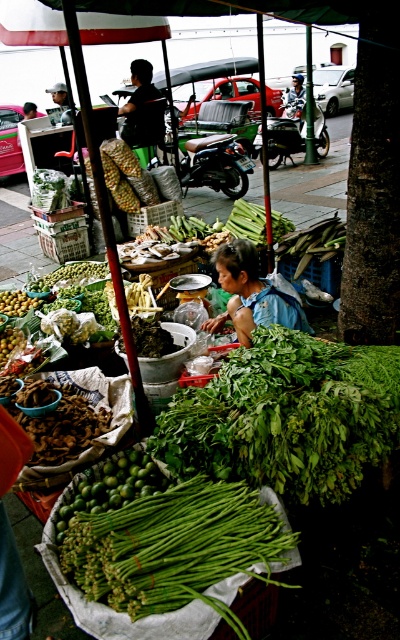
Question: Is green matte asparagus at center closer to camera compared to blue denim shirt at center?

Choices:
 (A) yes
 (B) no

Answer: (A)

Question: Which point is farther from the camera taking this photo?

Choices:
 (A) (262, 320)
 (B) (120, 460)
 (C) (216, 380)

Answer: (A)

Question: In this image, where is green matte asparagus at center located relative to green matte asparagus at lower center?

Choices:
 (A) above
 (B) below

Answer: (B)

Question: Is blue denim shirt at center to the right of green matte asparagus at lower center from the viewer's perspective?

Choices:
 (A) yes
 (B) no

Answer: (A)

Question: Which object appears closest to the camera in this image?

Choices:
 (A) blue denim shirt at center
 (B) green leafy at center
 (C) green matte asparagus at center
 (D) green matte asparagus at lower center

Answer: (C)

Question: Which of the following is the farthest from the observer?

Choices:
 (A) (274, 522)
 (B) (250, 246)
 (C) (154, 474)
 (D) (206, 442)

Answer: (B)